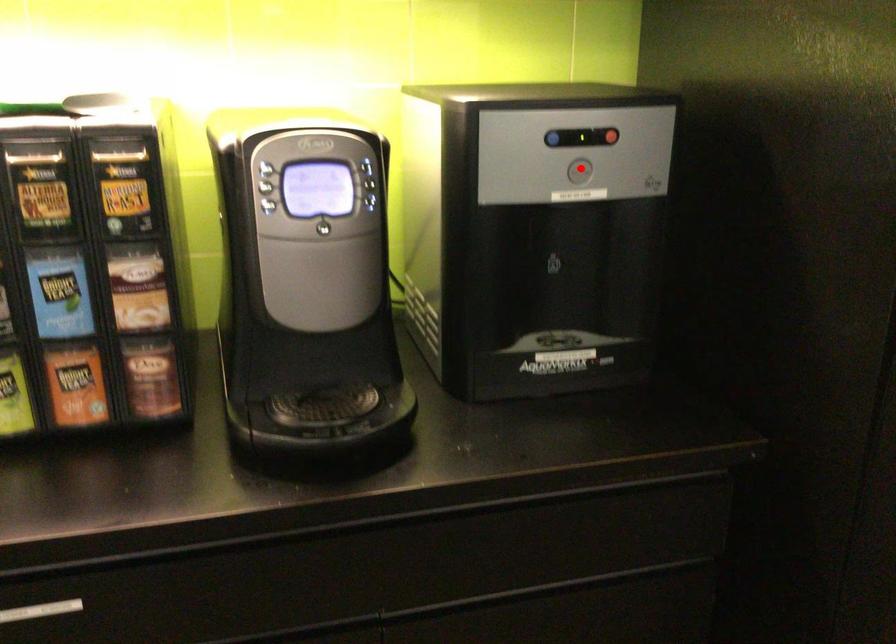
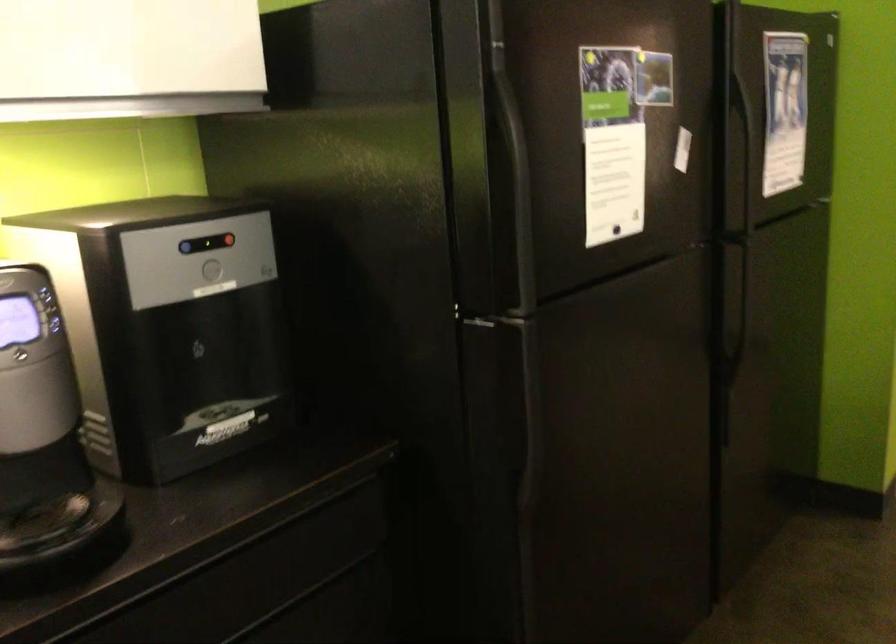
The point at the highlighted location is marked in the first image. Where is the corresponding point in the second image?

(211, 269)